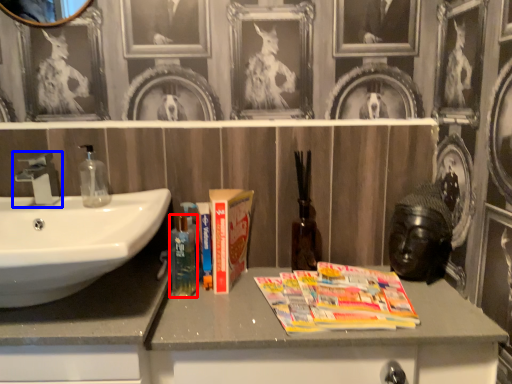
Question: Which point is closer to the camera, mouthwash (highlighted by a red box) or tap (highlighted by a blue box)?

Choices:
 (A) mouthwash
 (B) tap

Answer: (B)